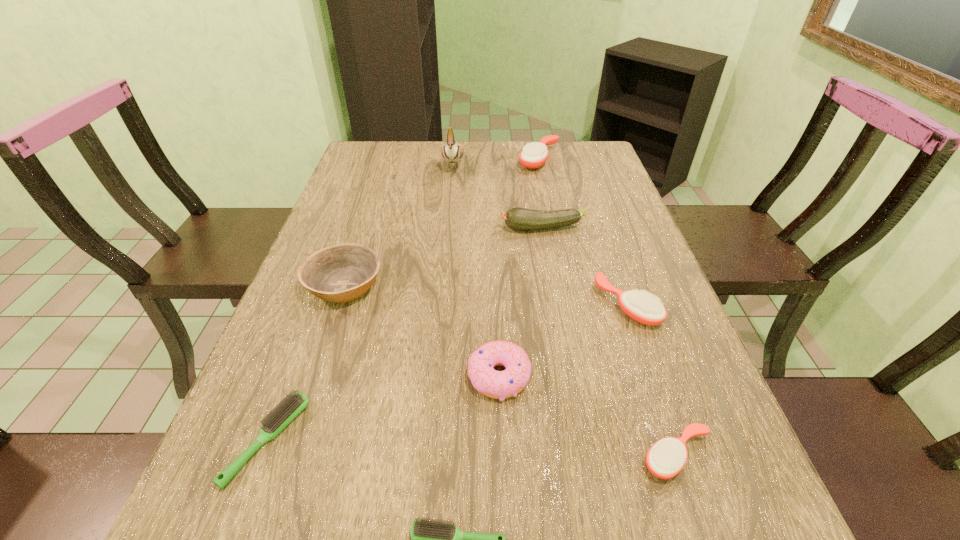
Where is `vacant area situated 0.230m on the back of the smallest orange hairbrush`? vacant area situated 0.230m on the back of the smallest orange hairbrush is located at coordinates (634, 328).

I want to click on vacant space located on the right of the leftmost hairbrush, so click(x=478, y=441).

The width and height of the screenshot is (960, 540). In order to click on bird that is at the far edge in this screenshot , I will do `click(452, 152)`.

The width and height of the screenshot is (960, 540). What are the coordinates of `hairbrush located at the far edge` in the screenshot? It's located at (x=534, y=155).

Where is `bowl that is at the left edge`? The width and height of the screenshot is (960, 540). bowl that is at the left edge is located at coordinates [340, 273].

This screenshot has width=960, height=540. I want to click on hairbrush that is at the left edge, so click(x=277, y=419).

Locate an element on the screen. The height and width of the screenshot is (540, 960). zucchini that is at the right edge is located at coordinates (523, 219).

Where is `object positioned at the far right corner`? This screenshot has width=960, height=540. object positioned at the far right corner is located at coordinates click(x=534, y=155).

Where is `free space at the far edge of the desktop`? free space at the far edge of the desktop is located at coordinates (488, 146).

This screenshot has width=960, height=540. I want to click on vacant space at the left edge, so click(383, 212).